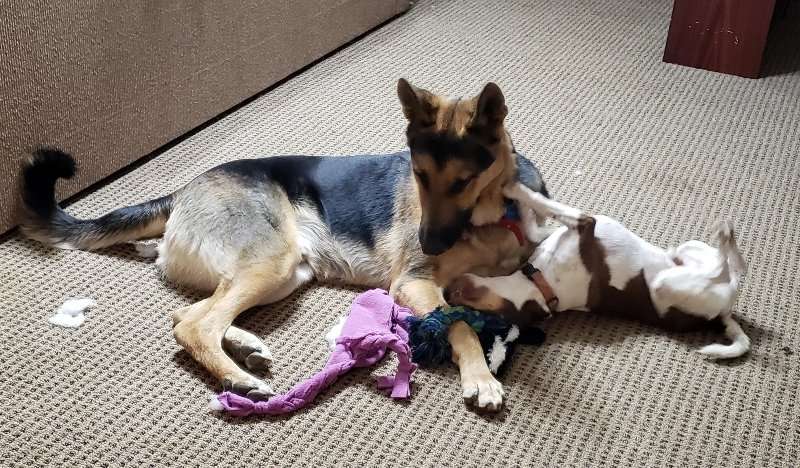
I want to click on wall, so click(x=257, y=60).